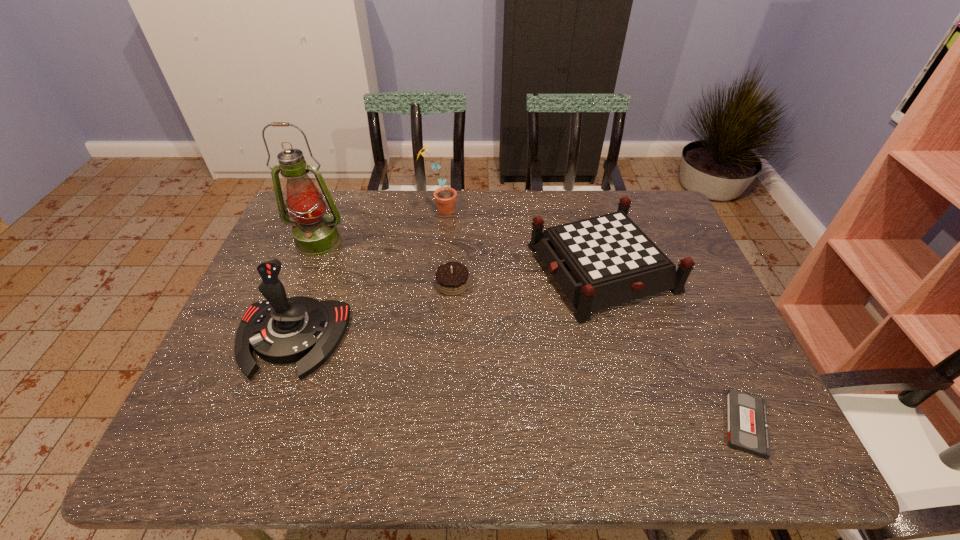
Where is `oil lamp`? This screenshot has width=960, height=540. oil lamp is located at coordinates (315, 234).

This screenshot has width=960, height=540. Find the location of `sunflower`. sunflower is located at coordinates (445, 197).

Find the location of a particular element. joystick is located at coordinates (280, 330).

Find the location of a particular element. This screenshot has width=960, height=540. checkerboard is located at coordinates (600, 262).

Image resolution: width=960 pixels, height=540 pixels. Identify the location of chocolate cake. (452, 279).

Image resolution: width=960 pixels, height=540 pixels. I want to click on the nearest object, so click(x=747, y=424).

This screenshot has height=540, width=960. Find the location of `the shortest object`. the shortest object is located at coordinates (747, 424).

In order to click on blank area located on the front of the tallest object in this screenshot , I will do `click(293, 305)`.

Where is `vacant area located 0.140m on the flower of the sunflower`? vacant area located 0.140m on the flower of the sunflower is located at coordinates (500, 210).

This screenshot has height=540, width=960. Identify the location of vacant region located on the handle side of the joystick. (250, 449).